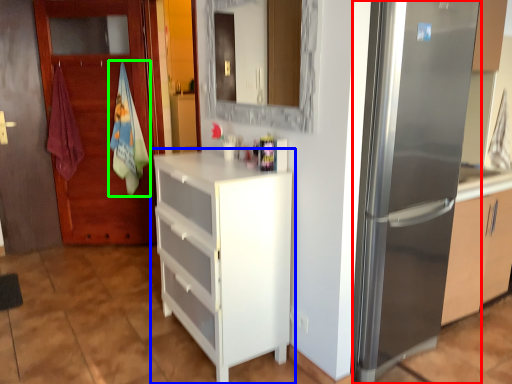
Question: Which is nearer to the refrigerator (highlighted by a red box)? chest of drawers (highlighted by a blue box) or beach towel (highlighted by a green box).

Choices:
 (A) chest of drawers
 (B) beach towel

Answer: (A)